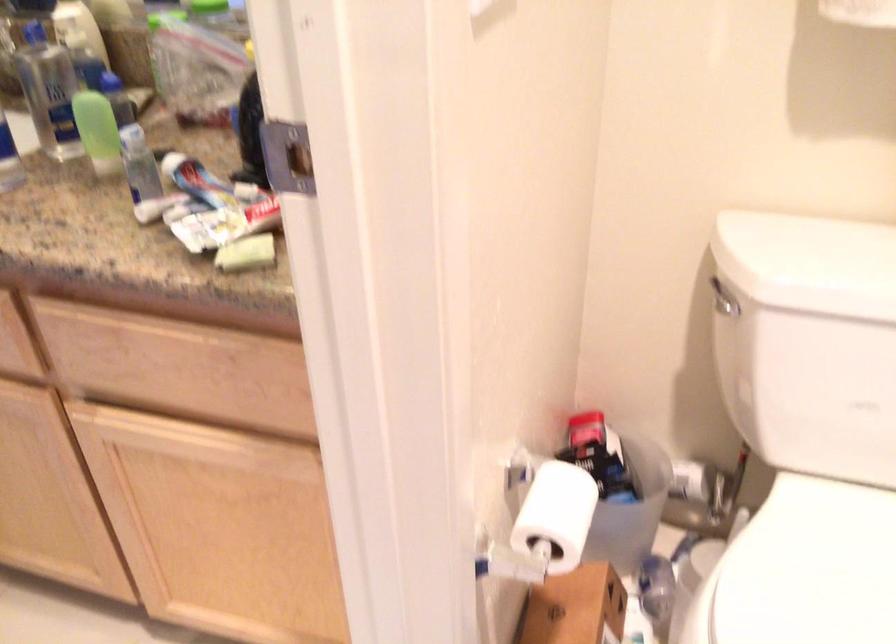
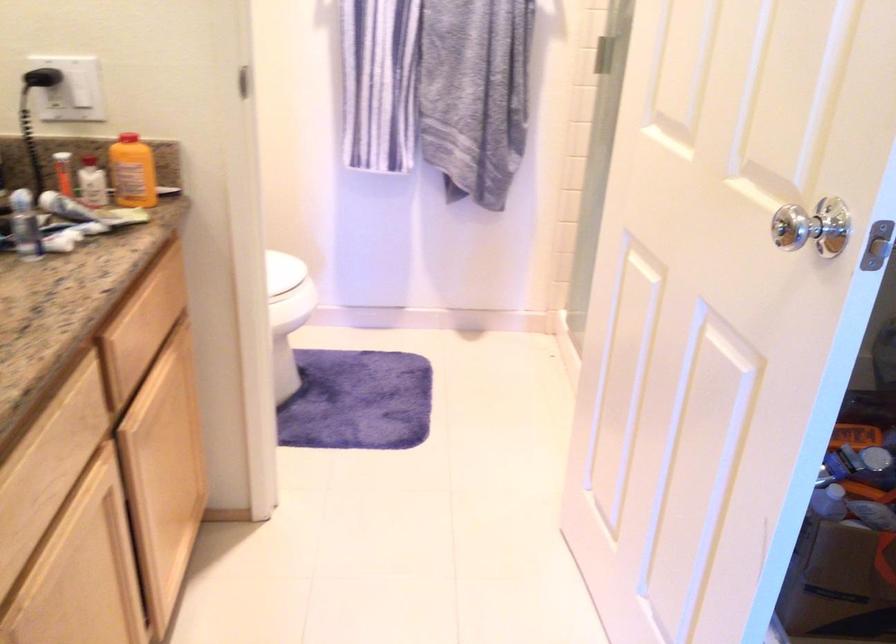
Question: I am providing you with two images of the same scene from different viewpoints. After the viewpoint changes to image2, which objects are now occluded?

Choices:
 (A) white lip balm
 (B) black electrical plug
 (C) silver door knob
 (D) toilet tank lid

Answer: (D)